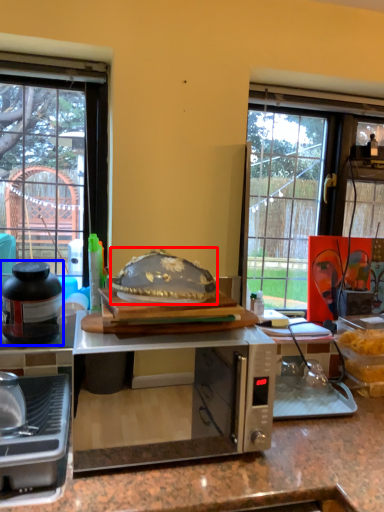
Question: Which object is closer to the camera taking this photo, food (highlighted by a red box) or kitchen appliance (highlighted by a blue box)?

Choices:
 (A) food
 (B) kitchen appliance

Answer: (A)